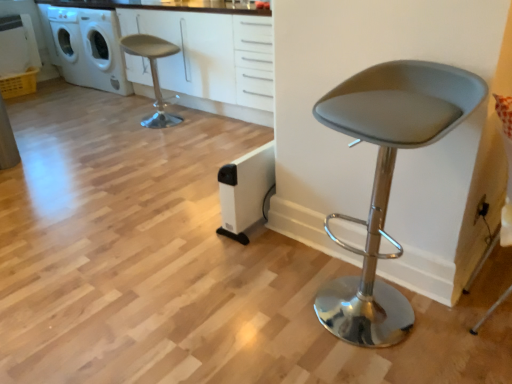
The image size is (512, 384). What are the coordinates of `free space in front of matte gray stool at upper left, marked as the second chair in a front-to-back arrangement` in the screenshot? It's located at (149, 140).